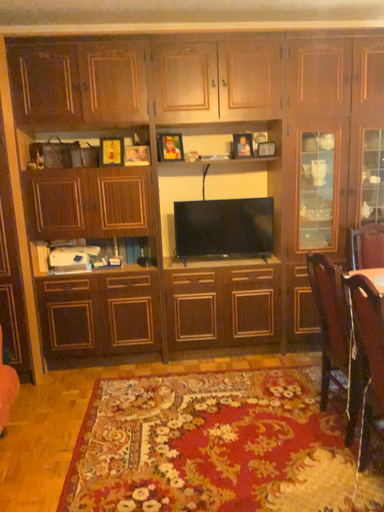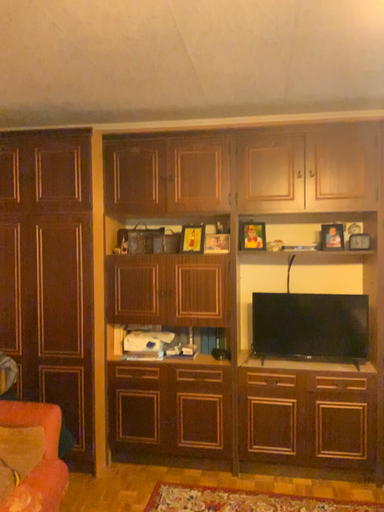
Question: Which way did the camera rotate in the video?

Choices:
 (A) rotated downward
 (B) rotated upward

Answer: (B)